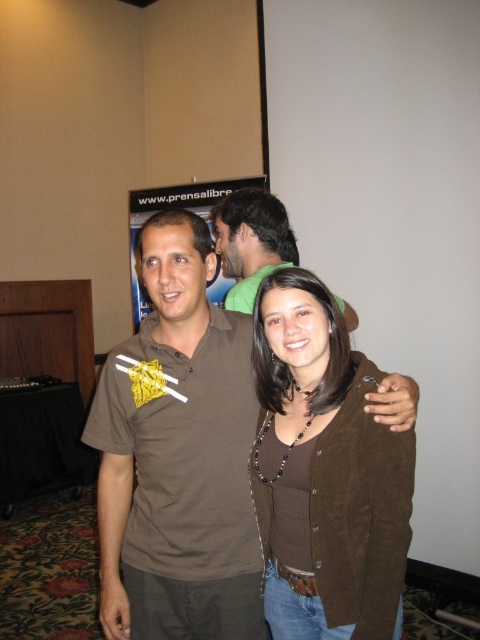
Question: Can you confirm if brown suede shirt at center is positioned below brown suede cardigan at center?

Choices:
 (A) no
 (B) yes

Answer: (A)

Question: Which object is closer to the camera taking this photo?

Choices:
 (A) brown cotton shirt at center
 (B) brown suede shirt at center
 (C) brown suede cardigan at center

Answer: (C)

Question: Is brown suede cardigan at center bigger than brown cotton shirt at center?

Choices:
 (A) yes
 (B) no

Answer: (B)

Question: Which of the following is the closest to the observer?

Choices:
 (A) (379, 472)
 (B) (264, 241)
 (C) (95, 433)

Answer: (A)

Question: Can you confirm if brown suede cardigan at center is positioned to the left of brown cotton shirt at center?

Choices:
 (A) yes
 (B) no

Answer: (B)

Question: Which of the following is the farthest from the observer?

Choices:
 (A) (216, 493)
 (B) (288, 372)

Answer: (B)